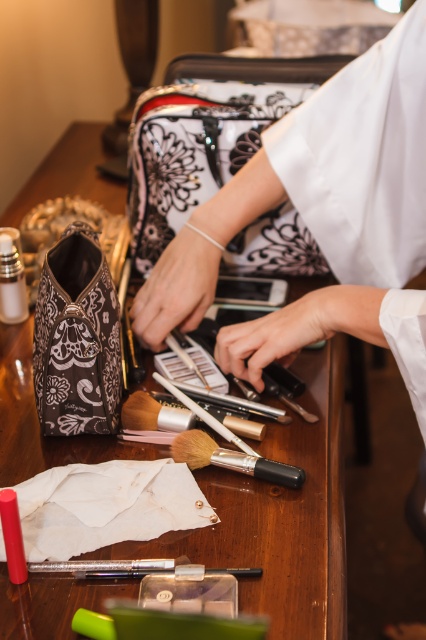
Question: Which of the following is the farthest from the observer?

Choices:
 (A) wooden table at center
 (B) black matte brush at center

Answer: (B)

Question: Can you confirm if wooden table at center is thinner than black matte brush at center?

Choices:
 (A) yes
 (B) no

Answer: (B)

Question: Does wooden table at center have a greater width compared to black matte brush at center?

Choices:
 (A) yes
 (B) no

Answer: (A)

Question: Can you confirm if wooden table at center is positioned to the right of black matte brush at center?

Choices:
 (A) no
 (B) yes

Answer: (A)

Question: Which point is farther to the camera?

Choices:
 (A) black matte brush at center
 (B) wooden table at center

Answer: (A)